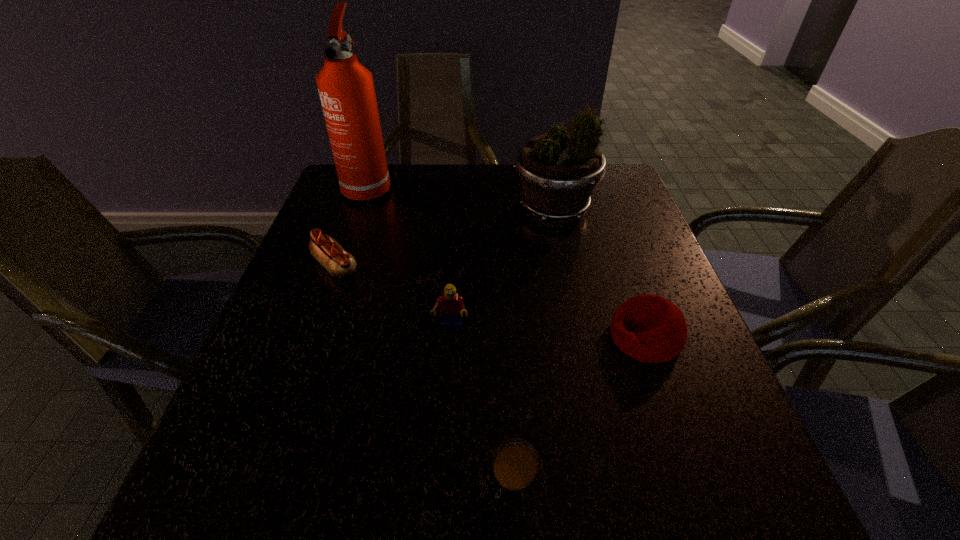
Identify the location of flowerpot that is at the right edge. This screenshot has width=960, height=540. (558, 172).

The image size is (960, 540). I want to click on beanbag that is at the right edge, so click(650, 328).

In order to click on object present at the far left corner in this screenshot , I will do `click(346, 89)`.

In order to click on object located at the far right corner in this screenshot , I will do [x=558, y=172].

In the image, there is a desktop. Identify the location of free space at the far edge. (459, 181).

Where is `free space at the near edge of the desktop`? This screenshot has width=960, height=540. free space at the near edge of the desktop is located at coordinates (523, 525).

Image resolution: width=960 pixels, height=540 pixels. In order to click on free space at the left edge of the desktop in this screenshot , I will do `click(353, 224)`.

In the image, there is a desktop. Identify the location of vacant space at the right edge. The width and height of the screenshot is (960, 540). click(x=610, y=232).

In order to click on vacant space at the far left corner of the desktop in this screenshot , I will do `click(382, 204)`.

Where is `vacant position at the far right corner of the desktop`? The image size is (960, 540). vacant position at the far right corner of the desktop is located at coordinates pyautogui.click(x=614, y=190).